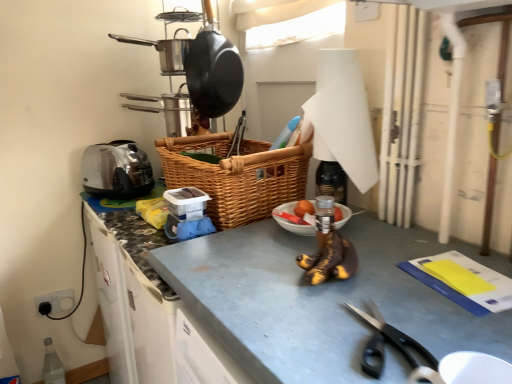
Question: Based on their sizes in the image, would you say black plastic scissors at lower right is bigger or smaller than matte black frying pan at upper center, which appears as the second frying pan when viewed from the left?

Choices:
 (A) small
 (B) big

Answer: (A)

Question: Considering the positions of point (369, 319) and point (221, 39), is point (369, 319) closer or farther from the camera than point (221, 39)?

Choices:
 (A) farther
 (B) closer

Answer: (B)

Question: Which is farther from the transparent plastic bottle at lower left?

Choices:
 (A) woven brown picnic basket at center
 (B) satin silver toaster at left
 (C) smooth gray countertop at center
 (D) matte black frying pan at upper center, which appears as the first frying pan when viewed from the right
 (E) white paper towel at upper center

Answer: (E)

Question: Estimate the real-world distances between objects in this image. Which object is farther from the white paper towel at upper center?

Choices:
 (A) transparent plastic bottle at lower left
 (B) satin silver toaster at left
 (C) shiny black frying pan at upper center, the second frying pan from the right
 (D) woven brown picnic basket at center
 (E) matte black frying pan at upper center, which appears as the first frying pan when viewed from the right

Answer: (A)